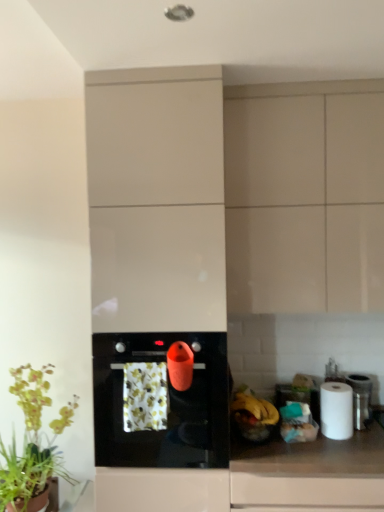
Question: Is white matte paper towel at right positioned beyond the bounds of yellow matte banana at right, which is counted as the first banana, starting from the right?

Choices:
 (A) yes
 (B) no

Answer: (A)

Question: Can you confirm if white matte paper towel at right is smaller than yellow matte banana at right, which is counted as the first banana, starting from the right?

Choices:
 (A) yes
 (B) no

Answer: (B)

Question: Does white matte paper towel at right contain yellow matte banana at right, which is counted as the first banana, starting from the right?

Choices:
 (A) yes
 (B) no

Answer: (B)

Question: Would you consider white matte paper towel at right to be distant from yellow matte banana at right, which is the second banana from left to right?

Choices:
 (A) no
 (B) yes

Answer: (A)

Question: Is white matte paper towel at right closer to camera compared to yellow matte banana at right, which is counted as the first banana, starting from the right?

Choices:
 (A) yes
 (B) no

Answer: (B)

Question: Does white matte paper towel at right have a greater width compared to yellow matte banana at right, which is counted as the first banana, starting from the right?

Choices:
 (A) yes
 (B) no

Answer: (B)

Question: Does black glossy oven at center have a lesser height compared to yellow matte banana at lower right, which is counted as the 2th banana, starting from the right?

Choices:
 (A) no
 (B) yes

Answer: (A)

Question: From the image's perspective, is black glossy oven at center under yellow matte banana at lower right, the 1th banana when ordered from left to right?

Choices:
 (A) yes
 (B) no

Answer: (B)

Question: Does black glossy oven at center have a larger size compared to yellow matte banana at lower right, which is counted as the 2th banana, starting from the right?

Choices:
 (A) yes
 (B) no

Answer: (A)

Question: Is black glossy oven at center further to the viewer compared to yellow matte banana at lower right, the 1th banana when ordered from left to right?

Choices:
 (A) yes
 (B) no

Answer: (B)

Question: From a real-world perspective, is black glossy oven at center positioned under yellow matte banana at lower right, the 1th banana when ordered from left to right, based on gravity?

Choices:
 (A) yes
 (B) no

Answer: (B)

Question: Is black glossy oven at center thinner than yellow matte banana at lower right, the 1th banana when ordered from left to right?

Choices:
 (A) yes
 (B) no

Answer: (B)

Question: Can you confirm if white matte paper towel at right is taller than floral-patterned fabric at center?

Choices:
 (A) no
 (B) yes

Answer: (A)